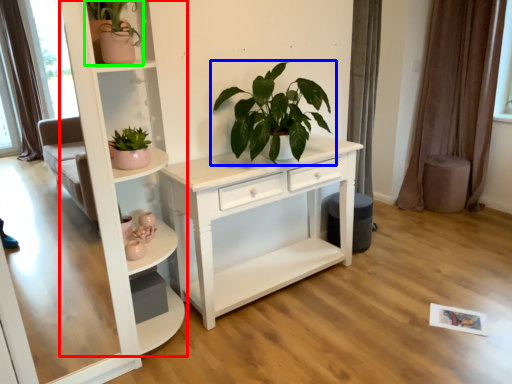
Question: Based on their relative distances, which object is nearer to shelf (highlighted by a red box)? Choose from houseplant (highlighted by a blue box) and houseplant (highlighted by a green box).

Choices:
 (A) houseplant
 (B) houseplant

Answer: (B)